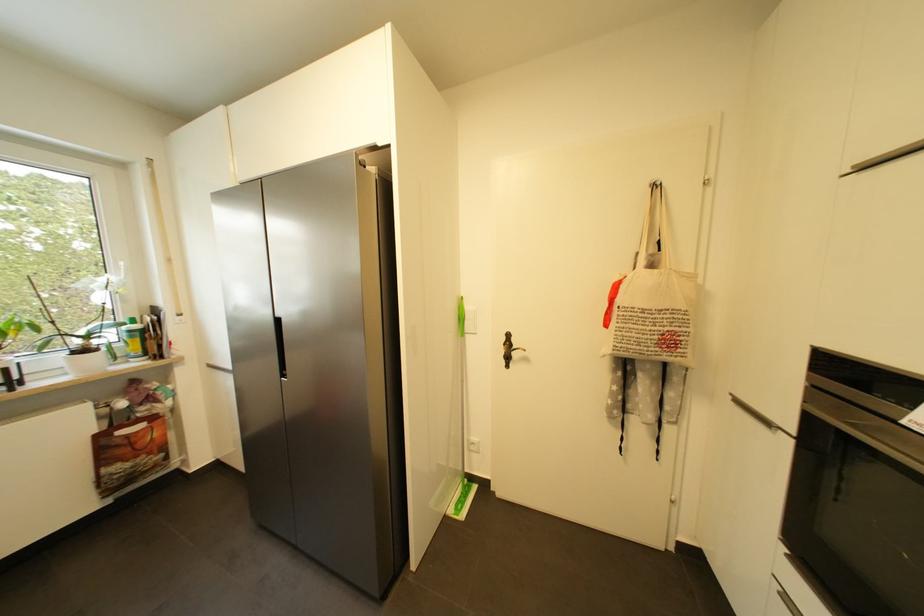
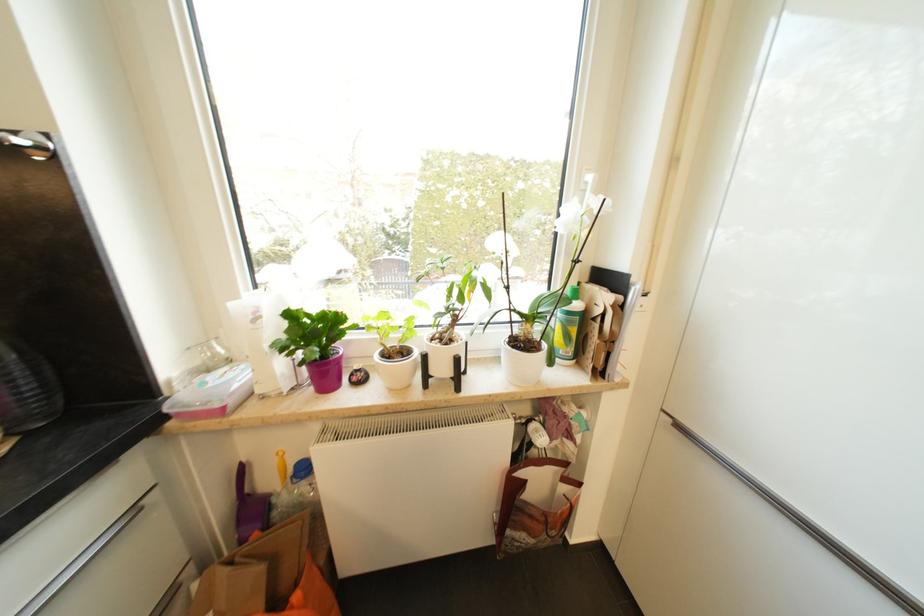
Where in the second image is the point corresponding to the point at 135,333 from the first image?

(574, 315)